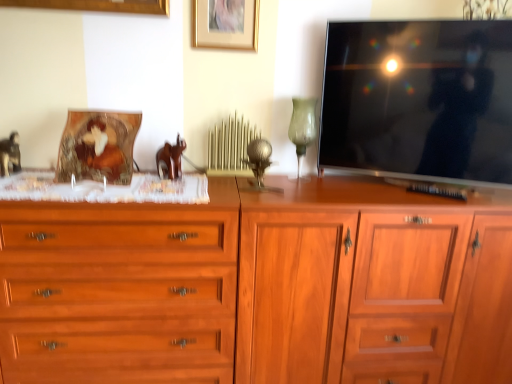
At what (x,y) coordinates should I click in order to perform the action: click on brown wooden horse at center. Please return your answer as a coordinate pair (x, y). Image resolution: width=512 pixels, height=384 pixels. Looking at the image, I should click on (170, 159).

Where is `metallic silver table lamp at center, marked as the first table lamp in a left-to-right arrangement`? The image size is (512, 384). metallic silver table lamp at center, marked as the first table lamp in a left-to-right arrangement is located at coordinates (259, 163).

Identify the location of wooden chest of drawers at left, the 1th chest of drawers when ordered from left to right. This screenshot has width=512, height=384. (119, 291).

Locate an element on the screen. This screenshot has width=512, height=384. brown wooden horse at center is located at coordinates (170, 159).

Is green glass vase at upper center, placed as the 1th table lamp when sorted from right to left, oriented towards brown wooden horse at center?

No, green glass vase at upper center, placed as the 1th table lamp when sorted from right to left, is not oriented towards brown wooden horse at center.

Could you measure the distance between green glass vase at upper center, placed as the 1th table lamp when sorted from right to left, and brown wooden horse at center?

green glass vase at upper center, placed as the 1th table lamp when sorted from right to left, is 21.10 inches from brown wooden horse at center.

What's the angular difference between green glass vase at upper center, the 2th table lamp from the left, and brown wooden horse at center's facing directions?

green glass vase at upper center, the 2th table lamp from the left, and brown wooden horse at center are facing 2.11 degrees away from each other.

Which is less distant, [308,129] or [178,135]?

Point [308,129] appears to be closer to the viewer than point [178,135].

Which of these two, green glass vase at upper center, the 2th table lamp from the left, or matte black tv at upper right, stands shorter?

green glass vase at upper center, the 2th table lamp from the left.

Choose the correct answer: Is green glass vase at upper center, placed as the 1th table lamp when sorted from right to left, inside matte black tv at upper right or outside it?

green glass vase at upper center, placed as the 1th table lamp when sorted from right to left, exists outside the volume of matte black tv at upper right.

Considering the relative positions of green glass vase at upper center, placed as the 1th table lamp when sorted from right to left, and matte black tv at upper right in the image provided, is green glass vase at upper center, placed as the 1th table lamp when sorted from right to left, to the left or to the right of matte black tv at upper right?

green glass vase at upper center, placed as the 1th table lamp when sorted from right to left, is to the left of matte black tv at upper right.

Considering the points (210, 27) and (301, 133), which point is behind, point (210, 27) or point (301, 133)?

The point (301, 133) is more distant.

Is gold matte picture frame at upper center wider or thinner than green glass vase at upper center, the 2th table lamp from the left?

Considering their sizes, gold matte picture frame at upper center looks slimmer than green glass vase at upper center, the 2th table lamp from the left.

Is green glass vase at upper center, the 2th table lamp from the left, inside gold matte picture frame at upper center?

No, green glass vase at upper center, the 2th table lamp from the left, is not surrounded by gold matte picture frame at upper center.

Does gold matte picture frame at upper center have a greater height compared to green glass vase at upper center, placed as the 1th table lamp when sorted from right to left?

No.

Is metallic silver table lamp at center, marked as the first table lamp in a left-to-right arrangement, completely or partially outside of wooden chest of drawers at left, the 1th chest of drawers when ordered from left to right?

Yes.

Between point (250, 160) and point (13, 360), which one is positioned behind?

The point (250, 160) is more distant.

Identify the location of table lamp that is the 1st object to the right of the wooden chest of drawers at left, the 1th chest of drawers when ordered from left to right, starting at the anchor. The height and width of the screenshot is (384, 512). (259, 163).

Based on the photo, from a real-world perspective, is metallic silver table lamp at center, marked as the first table lamp in a left-to-right arrangement, located higher than wooden chest of drawers at left, the 1th chest of drawers when ordered from left to right?

Yes.

Can you confirm if wooden cabinet at center, which is the first chest of drawers in right-to-left order, is smaller than green glass vase at upper center, the 2th table lamp from the left?

No, wooden cabinet at center, which is the first chest of drawers in right-to-left order, is not smaller than green glass vase at upper center, the 2th table lamp from the left.

Is green glass vase at upper center, placed as the 1th table lamp when sorted from right to left, completely or partially inside wooden cabinet at center, the 2th chest of drawers from the left?

No, green glass vase at upper center, placed as the 1th table lamp when sorted from right to left, is not a part of wooden cabinet at center, the 2th chest of drawers from the left.

From the image's perspective, between wooden cabinet at center, the 2th chest of drawers from the left, and green glass vase at upper center, placed as the 1th table lamp when sorted from right to left, which one is located above?

green glass vase at upper center, placed as the 1th table lamp when sorted from right to left, from the image's perspective.

From a real-world perspective, between wooden cabinet at center, the 2th chest of drawers from the left, and green glass vase at upper center, the 2th table lamp from the left, who is vertically higher?

In real-world perspective, green glass vase at upper center, the 2th table lamp from the left, is above.

Can you confirm if gold matte picture frame at upper center is wider than wooden chest of drawers at left, the 1th chest of drawers when ordered from left to right?

In fact, gold matte picture frame at upper center might be narrower than wooden chest of drawers at left, the 1th chest of drawers when ordered from left to right.

Who is bigger, gold matte picture frame at upper center or wooden chest of drawers at left, the 1th chest of drawers when ordered from left to right?

wooden chest of drawers at left, the 1th chest of drawers when ordered from left to right, is bigger.

From the image's perspective, is gold matte picture frame at upper center positioned above or below wooden chest of drawers at left, which is the second chest of drawers in right-to-left order?

From the image's perspective, gold matte picture frame at upper center appears above wooden chest of drawers at left, which is the second chest of drawers in right-to-left order.

Is gold matte picture frame at upper center shorter than wooden chest of drawers at left, which is the second chest of drawers in right-to-left order?

Yes, gold matte picture frame at upper center is shorter than wooden chest of drawers at left, which is the second chest of drawers in right-to-left order.

From a real-world perspective, does brown wooden horse at center stand above wooden cabinet at center, which is the first chest of drawers in right-to-left order?

Yes, from a real-world perspective, brown wooden horse at center is on top of wooden cabinet at center, which is the first chest of drawers in right-to-left order.

Starting from the brown wooden horse at center, which chest of drawers is the 1st one in front? Please provide its 2D coordinates.

[(260, 287)]

Can you confirm if brown wooden horse at center is taller than wooden cabinet at center, which is the first chest of drawers in right-to-left order?

In fact, brown wooden horse at center may be shorter than wooden cabinet at center, which is the first chest of drawers in right-to-left order.

Which is more to the left, brown wooden horse at center or wooden cabinet at center, which is the first chest of drawers in right-to-left order?

brown wooden horse at center.

Where is `animal in front of the green glass vase at upper center, placed as the 1th table lamp when sorted from right to left`? Image resolution: width=512 pixels, height=384 pixels. animal in front of the green glass vase at upper center, placed as the 1th table lamp when sorted from right to left is located at coordinates (170, 159).

This screenshot has width=512, height=384. I want to click on television above the green glass vase at upper center, the 2th table lamp from the left (from a real-world perspective), so click(x=419, y=99).

Estimate the real-world distances between objects in this image. Which object is further from gold matte picture frame at upper center, wooden cabinet at center, which is the first chest of drawers in right-to-left order, or metallic silver table lamp at center, marked as the first table lamp in a left-to-right arrangement?

The object further to gold matte picture frame at upper center is wooden cabinet at center, which is the first chest of drawers in right-to-left order.

From the image, which object appears to be nearer to gold matte picture frame at upper center, brown wooden horse at center or green glass vase at upper center, the 2th table lamp from the left?

The object closer to gold matte picture frame at upper center is green glass vase at upper center, the 2th table lamp from the left.

Considering their positions, is green glass vase at upper center, placed as the 1th table lamp when sorted from right to left, positioned closer to matte black tv at upper right than gold matte picture frame at upper center?

Among the two, green glass vase at upper center, placed as the 1th table lamp when sorted from right to left, is located nearer to matte black tv at upper right.

Estimate the real-world distances between objects in this image. Which object is closer to brown wooden horse at center, gold matte picture frame at upper center or wooden cabinet at center, which is the first chest of drawers in right-to-left order?

gold matte picture frame at upper center lies closer to brown wooden horse at center than the other object.

When comparing their distances from matte black tv at upper right, does metallic silver table lamp at center, placed as the second table lamp when sorted from right to left, or gold matte picture frame at upper center seem further?

gold matte picture frame at upper center is further to matte black tv at upper right.

Considering their positions, is matte black tv at upper right positioned closer to wooden chest of drawers at left, which is the second chest of drawers in right-to-left order, than gold matte picture frame at upper center?

Based on the image, matte black tv at upper right appears to be nearer to wooden chest of drawers at left, which is the second chest of drawers in right-to-left order.

Which object lies nearer to the anchor point wooden chest of drawers at left, which is the second chest of drawers in right-to-left order, brown wooden horse at center or gold matte picture frame at upper center?

Based on the image, brown wooden horse at center appears to be nearer to wooden chest of drawers at left, which is the second chest of drawers in right-to-left order.

Looking at the image, which one is located closer to wooden cabinet at center, which is the first chest of drawers in right-to-left order, matte black tv at upper right or brown wooden horse at center?

matte black tv at upper right is closer to wooden cabinet at center, which is the first chest of drawers in right-to-left order.

Locate an element on the screen. The image size is (512, 384). animal located between wooden chest of drawers at left, the 1th chest of drawers when ordered from left to right, and matte black tv at upper right in the left-right direction is located at coordinates (170, 159).

Image resolution: width=512 pixels, height=384 pixels. In order to click on table lamp situated between brown wooden horse at center and green glass vase at upper center, the 2th table lamp from the left, from left to right in this screenshot , I will do (x=259, y=163).

Where is `picture frame between wooden chest of drawers at left, the 1th chest of drawers when ordered from left to right, and matte black tv at upper right, in the horizontal direction`? This screenshot has height=384, width=512. picture frame between wooden chest of drawers at left, the 1th chest of drawers when ordered from left to right, and matte black tv at upper right, in the horizontal direction is located at coordinates (226, 24).

Identify the location of table lamp between green glass vase at upper center, the 2th table lamp from the left, and wooden cabinet at center, which is the first chest of drawers in right-to-left order, in the up-down direction. pos(259,163).